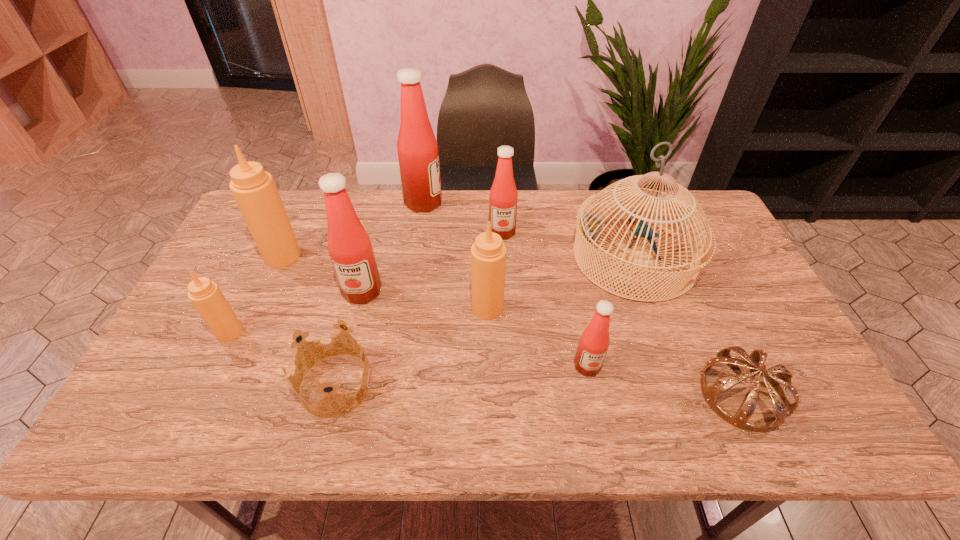
You are a GUI agent. You are given a task and a screenshot of the screen. Output one action in this format:
    pyautogui.click(x=<x>, y=<y>)
    Task: Click on the tallest condiment
    This screenshot has width=960, height=540.
    Given the screenshot: What is the action you would take?
    pyautogui.click(x=417, y=148)

The image size is (960, 540). What are the coordinates of `the farthest object` in the screenshot? It's located at (417, 148).

You are a GUI agent. You are given a task and a screenshot of the screen. Output one action in this format:
    pyautogui.click(x=<x>, y=<y>)
    Task: Click on the biggest tan condiment
    
    Given the screenshot: What is the action you would take?
    pyautogui.click(x=255, y=192)

You are a GUI agent. You are given a task and a screenshot of the screen. Output one action in this format:
    pyautogui.click(x=<x>, y=<y>)
    Task: Click on the farthest tan condiment
    
    Given the screenshot: What is the action you would take?
    pyautogui.click(x=255, y=192)

The height and width of the screenshot is (540, 960). Find the location of `the third condiment from left to right`. the third condiment from left to right is located at coordinates (349, 246).

This screenshot has width=960, height=540. I want to click on the leftmost red condiment, so click(x=349, y=246).

Locate an element on the screen. This screenshot has height=540, width=960. birdcage is located at coordinates (x=589, y=228).

Where is `the second nearest tan condiment`? This screenshot has width=960, height=540. the second nearest tan condiment is located at coordinates (488, 253).

I want to click on the rightmost tan condiment, so click(x=488, y=253).

At what (x,y) coordinates should I click in order to perform the action: click on the third nearest red condiment. Please return your answer as a coordinate pair (x, y). Looking at the image, I should click on (503, 196).